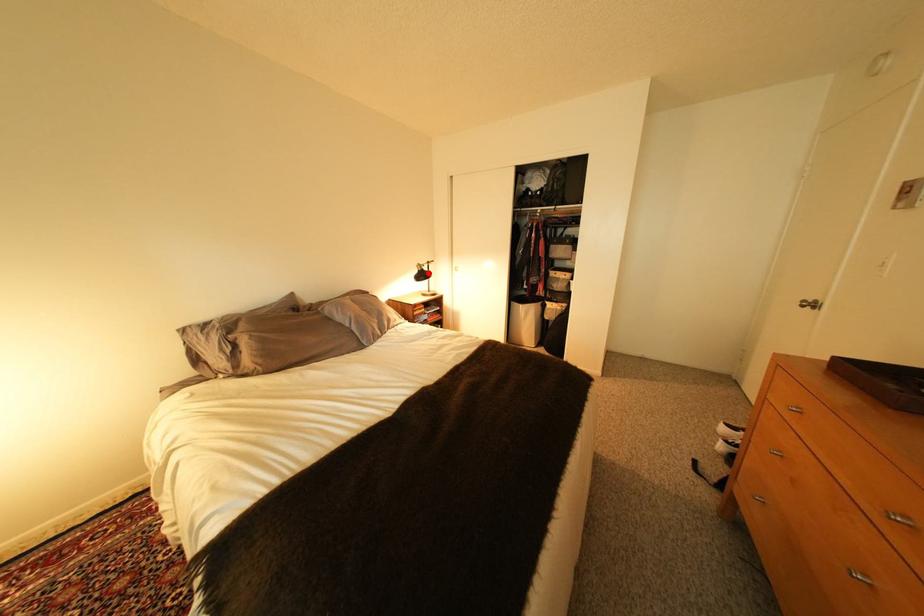
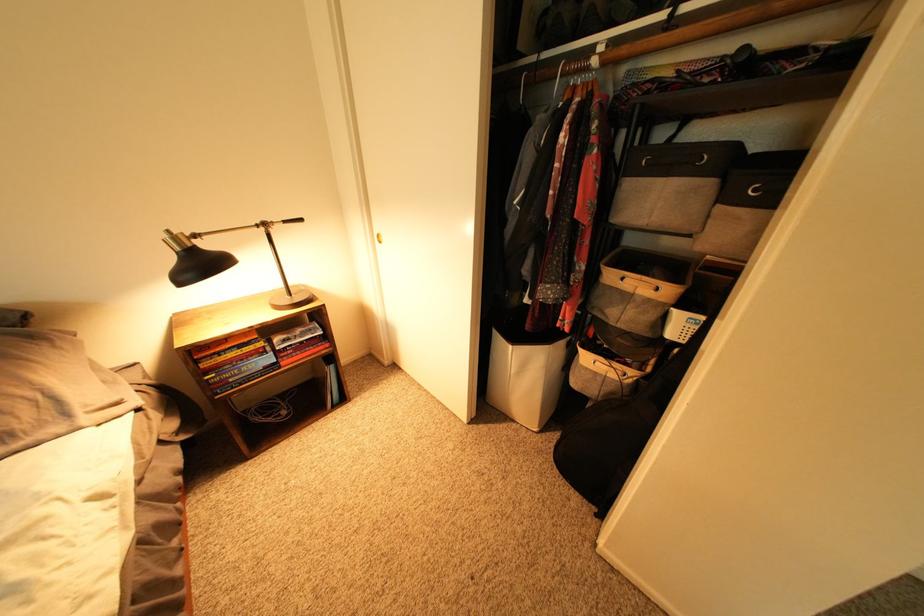
The point at the highlighted location is marked in the first image. Where is the corresponding point in the second image?

(198, 254)